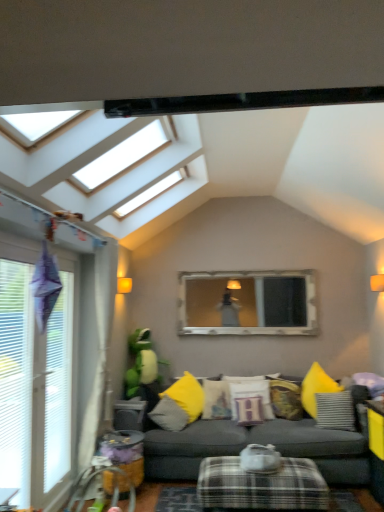
Question: Can matte yellow pillow at center, the fourth pillow in the right-to-left sequence, be found inside yellow fabric pillow at center, which ranks as the fifth pillow in right-to-left order?

Choices:
 (A) no
 (B) yes

Answer: (A)

Question: From a real-world perspective, is yellow fabric pillow at center, which ranks as the fifth pillow in right-to-left order, on top of matte yellow pillow at center, the second pillow in the left-to-right sequence?

Choices:
 (A) no
 (B) yes

Answer: (A)

Question: From the image's perspective, is yellow fabric pillow at center, which ranks as the fifth pillow in right-to-left order, under matte yellow pillow at center, the second pillow in the left-to-right sequence?

Choices:
 (A) no
 (B) yes

Answer: (B)

Question: Is yellow fabric pillow at center, which is counted as the first pillow, starting from the left, oriented away from matte yellow pillow at center, the fourth pillow in the right-to-left sequence?

Choices:
 (A) no
 (B) yes

Answer: (A)

Question: Could you tell me if yellow fabric pillow at center, which is counted as the first pillow, starting from the left, is facing matte yellow pillow at center, the second pillow in the left-to-right sequence?

Choices:
 (A) no
 (B) yes

Answer: (A)

Question: Do you think textured yellow pillow at center, acting as the 2th pillow starting from the right, is within beige fabric curtain at left, or outside of it?

Choices:
 (A) inside
 (B) outside

Answer: (B)

Question: From a real-world perspective, is textured yellow pillow at center, the 4th pillow viewed from the left, physically located above or below beige fabric curtain at left?

Choices:
 (A) below
 (B) above

Answer: (A)

Question: Is textured yellow pillow at center, acting as the 2th pillow starting from the right, in front of or behind beige fabric curtain at left in the image?

Choices:
 (A) behind
 (B) front

Answer: (A)

Question: Visually, is textured yellow pillow at center, acting as the 2th pillow starting from the right, positioned to the left or to the right of beige fabric curtain at left?

Choices:
 (A) left
 (B) right

Answer: (B)

Question: From their relative heights in the image, would you say textured yellow pillow at center, the 4th pillow viewed from the left, is taller or shorter than white plastic window at left?

Choices:
 (A) short
 (B) tall

Answer: (A)

Question: From the image's perspective, is textured yellow pillow at center, acting as the 2th pillow starting from the right, positioned above or below white plastic window at left?

Choices:
 (A) above
 (B) below

Answer: (B)

Question: Is point (284, 391) positioned closer to the camera than point (59, 437)?

Choices:
 (A) closer
 (B) farther

Answer: (B)

Question: From a real-world perspective, is textured yellow pillow at center, the 4th pillow viewed from the left, physically located above or below white plastic window at left?

Choices:
 (A) below
 (B) above

Answer: (A)

Question: Does point (274, 489) appear closer or farther from the camera than point (223, 323)?

Choices:
 (A) farther
 (B) closer

Answer: (B)

Question: Visually, is plaid fabric ottoman at lower center positioned to the left or to the right of silver-framed mirror at center?

Choices:
 (A) right
 (B) left

Answer: (B)